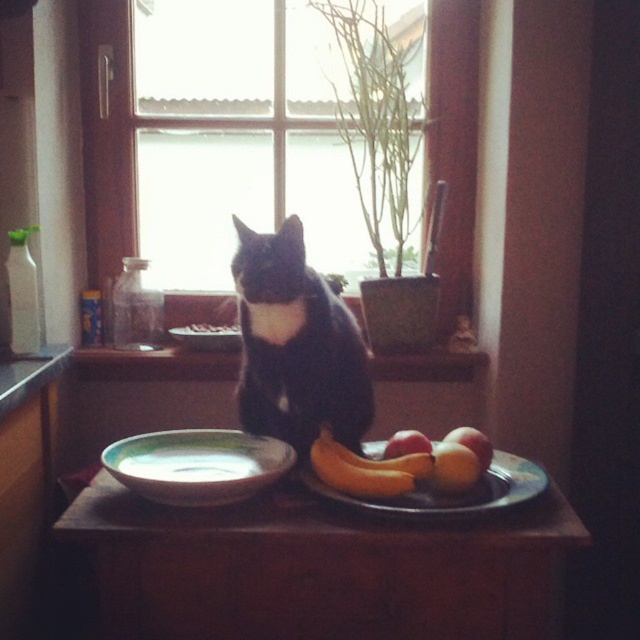
You are a small toy mouse that is 5 cm tall. You want to hide under the black fur cat at center so that the smooth yellow apple at lower right cannot see you. Is this possible?

The black fur cat at center is much taller than the smooth yellow apple at lower right. Since the cat is taller, hiding under it would block the apple from seeing you.

You are a small toy mouse that is 10 cm tall. You want to play under the wooden table at center. Can you fit under it if the black fur cat at center is also there?

The wooden table at center is shorter than the black fur cat at center. Since the cat is taller than the table, the toy mouse cannot fit under the table while the cat is present because the cat would block the space.